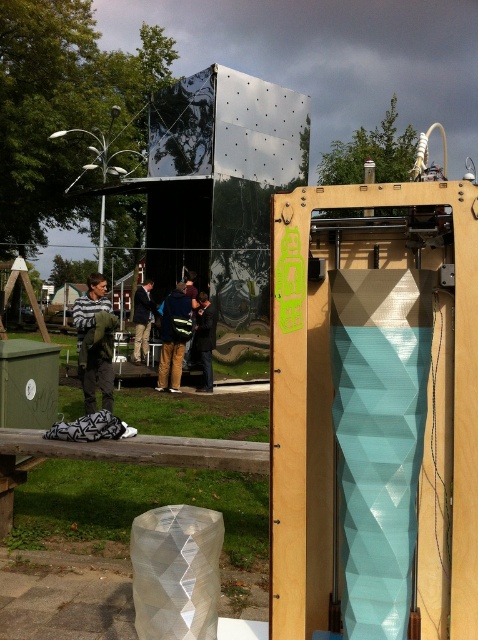
Question: Which point is farther to the camera?

Choices:
 (A) dark blue jeans at center
 (B) green fabric jacket at center
 (C) dark blue jacket at center

Answer: (A)

Question: Where is green fabric jacket at center located in relation to reflective metallic jacket at center in the image?

Choices:
 (A) right
 (B) left

Answer: (B)

Question: From the image, what is the correct spatial relationship of dark blue backpack at center in relation to dark blue jacket at center?

Choices:
 (A) above
 (B) below

Answer: (A)

Question: From the image, what is the correct spatial relationship of dark blue backpack at center in relation to dark blue jeans at center?

Choices:
 (A) right
 (B) left

Answer: (A)

Question: Estimate the real-world distances between objects in this image. Which object is closer to the reflective metallic jacket at center?

Choices:
 (A) dark blue backpack at center
 (B) green fabric jacket at center

Answer: (A)

Question: Which object is farther from the camera taking this photo?

Choices:
 (A) dark blue backpack at center
 (B) dark blue jeans at center
 (C) green fabric jacket at center

Answer: (B)